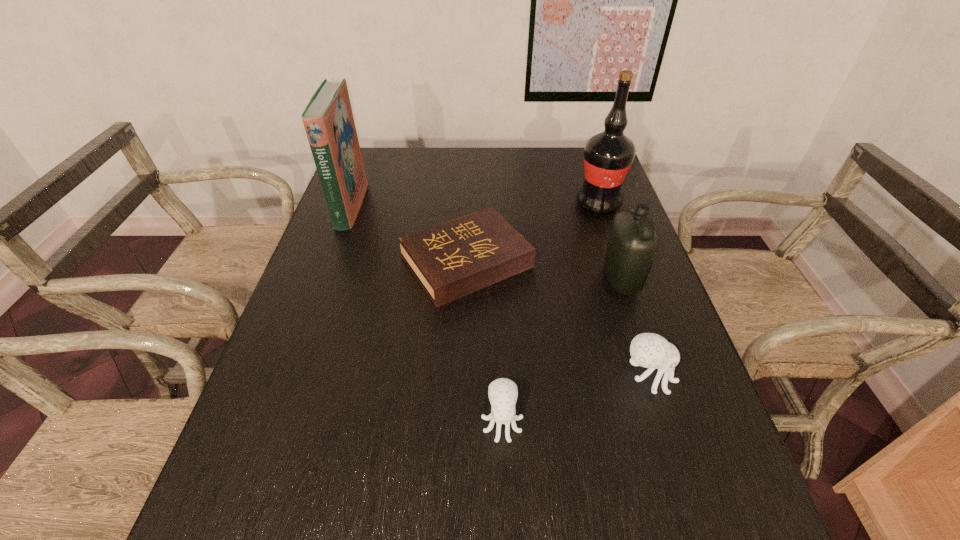
Locate an element on the screen. The height and width of the screenshot is (540, 960). the nearest object is located at coordinates (503, 392).

At what (x,y) coordinates should I click in order to perform the action: click on the nearer octopus. Please return your answer as a coordinate pair (x, y). Image resolution: width=960 pixels, height=540 pixels. Looking at the image, I should click on (503, 392).

Identify the location of the right octopus. (649, 350).

Locate an element on the screen. The height and width of the screenshot is (540, 960). the farther octopus is located at coordinates (649, 350).

This screenshot has width=960, height=540. What are the coordinates of `the taller hardback book` in the screenshot? It's located at (328, 119).

This screenshot has height=540, width=960. I want to click on the left hardback book, so click(x=328, y=119).

Find the location of a particular element. The image size is (960, 540). the shorter hardback book is located at coordinates (453, 259).

Where is `the shortest object`? The height and width of the screenshot is (540, 960). the shortest object is located at coordinates (453, 259).

Locate an element on the screen. This screenshot has height=540, width=960. wine bottle is located at coordinates click(x=608, y=156).

Where is `the third tallest object`? The image size is (960, 540). the third tallest object is located at coordinates (633, 244).